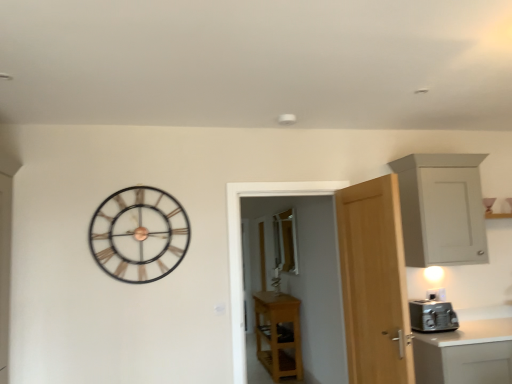
Question: Can you confirm if clear glass window at center is wider than light wood door at right?

Choices:
 (A) yes
 (B) no

Answer: (B)

Question: Is clear glass window at center not close to light wood door at right?

Choices:
 (A) yes
 (B) no

Answer: (A)

Question: Does clear glass window at center appear on the left side of light wood door at right?

Choices:
 (A) no
 (B) yes

Answer: (B)

Question: Considering the relative sizes of clear glass window at center and light wood door at right in the image provided, is clear glass window at center taller than light wood door at right?

Choices:
 (A) no
 (B) yes

Answer: (A)

Question: Can light wood door at right be found inside clear glass window at center?

Choices:
 (A) no
 (B) yes

Answer: (A)

Question: Can you confirm if clear glass window at center is positioned to the right of light wood door at right?

Choices:
 (A) yes
 (B) no

Answer: (B)

Question: Is the depth of metallic gold clock at upper left less than that of white matte cabinet at upper right, marked as the second cabinetry in a back-to-front arrangement?

Choices:
 (A) yes
 (B) no

Answer: (A)

Question: Is metallic gold clock at upper left oriented away from white matte cabinet at upper right, marked as the second cabinetry in a back-to-front arrangement?

Choices:
 (A) no
 (B) yes

Answer: (A)

Question: From a real-world perspective, is metallic gold clock at upper left physically below white matte cabinet at upper right, the first cabinetry viewed from the right?

Choices:
 (A) yes
 (B) no

Answer: (A)

Question: Is metallic gold clock at upper left at the right side of white matte cabinet at upper right, which is the 1th cabinetry in front-to-back order?

Choices:
 (A) no
 (B) yes

Answer: (A)

Question: From the image's perspective, is metallic gold clock at upper left below white matte cabinet at upper right, the first cabinetry viewed from the right?

Choices:
 (A) yes
 (B) no

Answer: (A)

Question: Is white matte cabinet at upper right, the 2th cabinetry from the left, surrounded by metallic gold clock at upper left?

Choices:
 (A) yes
 (B) no

Answer: (B)

Question: Considering the relative sizes of light wood door at right and white matte cabinet at upper right, marked as the second cabinetry in a back-to-front arrangement, in the image provided, is light wood door at right wider than white matte cabinet at upper right, marked as the second cabinetry in a back-to-front arrangement,?

Choices:
 (A) no
 (B) yes

Answer: (A)